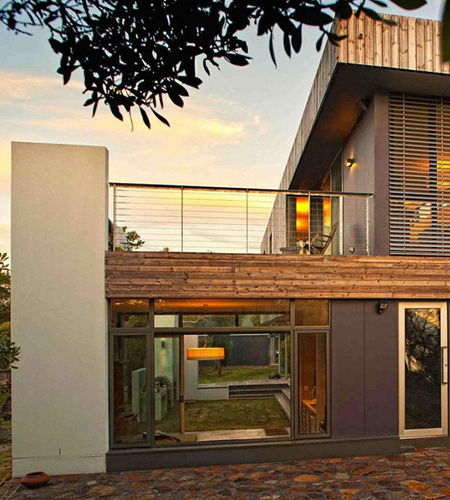
You are a GUI agent. You are given a task and a screenshot of the screen. Output one action in this format:
    pyautogui.click(x=<x>, y=<y>)
    Task: Click on the chair
    The width and height of the screenshot is (450, 500).
    Given the screenshot: What is the action you would take?
    pyautogui.click(x=323, y=240)